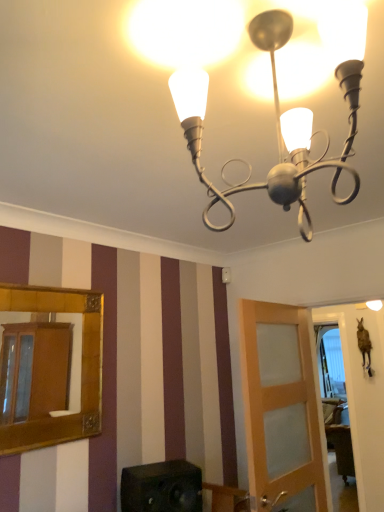
Question: Does metallic silver chandelier at upper center have a greater width compared to gold-framed mirror at left?

Choices:
 (A) yes
 (B) no

Answer: (A)

Question: Is gold-framed mirror at left completely or partially inside metallic silver chandelier at upper center?

Choices:
 (A) no
 (B) yes

Answer: (A)

Question: Is metallic silver chandelier at upper center thinner than gold-framed mirror at left?

Choices:
 (A) no
 (B) yes

Answer: (A)

Question: Does metallic silver chandelier at upper center come behind gold-framed mirror at left?

Choices:
 (A) yes
 (B) no

Answer: (B)

Question: From a real-world perspective, is metallic silver chandelier at upper center physically below gold-framed mirror at left?

Choices:
 (A) yes
 (B) no

Answer: (B)

Question: Is metallic silver chandelier at upper center in front of or behind gold-framed mirror at left in the image?

Choices:
 (A) front
 (B) behind

Answer: (A)

Question: In terms of size, does metallic silver chandelier at upper center appear bigger or smaller than gold-framed mirror at left?

Choices:
 (A) small
 (B) big

Answer: (B)

Question: Considering the relative positions of metallic silver chandelier at upper center and gold-framed mirror at left in the image provided, is metallic silver chandelier at upper center to the left or to the right of gold-framed mirror at left?

Choices:
 (A) left
 (B) right

Answer: (B)

Question: Is point (230, 185) positioned closer to the camera than point (99, 334)?

Choices:
 (A) farther
 (B) closer

Answer: (B)

Question: From a real-world perspective, is gold-framed mirror at left positioned above or below black matte speaker at lower center?

Choices:
 (A) above
 (B) below

Answer: (A)

Question: From the image's perspective, is gold-framed mirror at left above or below black matte speaker at lower center?

Choices:
 (A) above
 (B) below

Answer: (A)

Question: Is gold-framed mirror at left in front of or behind black matte speaker at lower center in the image?

Choices:
 (A) front
 (B) behind

Answer: (A)

Question: Considering the positions of gold-framed mirror at left and black matte speaker at lower center in the image, is gold-framed mirror at left bigger or smaller than black matte speaker at lower center?

Choices:
 (A) small
 (B) big

Answer: (A)

Question: Is metallic silver chandelier at upper center bigger or smaller than black matte speaker at lower center?

Choices:
 (A) small
 (B) big

Answer: (B)

Question: Is metallic silver chandelier at upper center taller or shorter than black matte speaker at lower center?

Choices:
 (A) short
 (B) tall

Answer: (B)